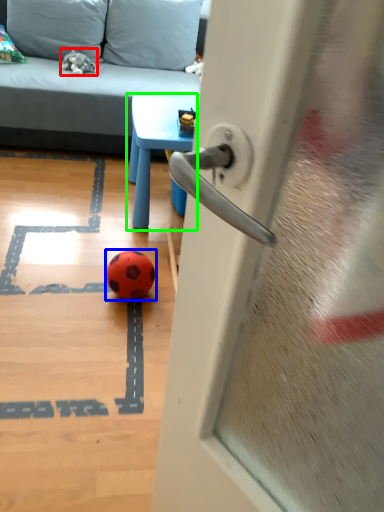
Question: Based on their relative distances, which object is nearer to miniature (highlighted by a red box)? Choose from ball (highlighted by a blue box) and table (highlighted by a green box).

Choices:
 (A) ball
 (B) table

Answer: (B)